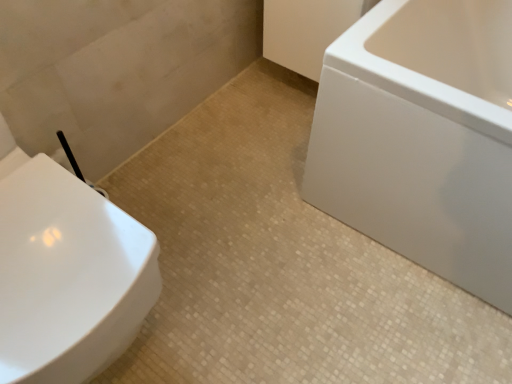
Describe the element at coordinates (422, 137) in the screenshot. I see `white glossy bathtub at right` at that location.

The image size is (512, 384). What do you see at coordinates (282, 263) in the screenshot? I see `beige mosaic tile at center` at bounding box center [282, 263].

Locate an element on the screen. Image resolution: width=512 pixels, height=384 pixels. white glossy toilet at left is located at coordinates (68, 276).

Is point (449, 227) closer to camera compared to point (99, 319)?

No, it is behind (99, 319).

Considering the relative positions of white glossy bathtub at right and white glossy toilet at left in the image provided, is white glossy bathtub at right to the left of white glossy toilet at left from the viewer's perspective?

Incorrect, white glossy bathtub at right is not on the left side of white glossy toilet at left.

From the image's perspective, which object appears higher, white glossy bathtub at right or white glossy toilet at left?

From the image's view, white glossy bathtub at right is above.

Is white glossy bathtub at right facing towards white glossy toilet at left?

Yes, white glossy bathtub at right is aimed at white glossy toilet at left.

Is beige mosaic tile at center not inside white glossy bathtub at right?

beige mosaic tile at center lies outside white glossy bathtub at right's area.

Between beige mosaic tile at center and white glossy bathtub at right, which one has more height?

With more height is white glossy bathtub at right.

From a real-world perspective, between beige mosaic tile at center and white glossy bathtub at right, who is vertically lower?

beige mosaic tile at center.

Can you confirm if beige mosaic tile at center is positioned to the right of white glossy bathtub at right?

No.

Considering the positions of objects white glossy toilet at left and beige mosaic tile at center in the image provided, who is more to the left, white glossy toilet at left or beige mosaic tile at center?

From the viewer's perspective, white glossy toilet at left appears more on the left side.

Which of these two, white glossy toilet at left or beige mosaic tile at center, is wider?

Wider between the two is beige mosaic tile at center.

From a real-world perspective, is white glossy toilet at left physically located above or below beige mosaic tile at center?

From a real-world perspective, white glossy toilet at left is physically above beige mosaic tile at center.

Are white glossy toilet at left and beige mosaic tile at center beside each other?

No, white glossy toilet at left is not with beige mosaic tile at center.

Do you think white glossy toilet at left is within white glossy bathtub at right, or outside of it?

white glossy toilet at left is spatially situated outside white glossy bathtub at right.

Considering the sizes of objects white glossy toilet at left and white glossy bathtub at right in the image provided, who is wider, white glossy toilet at left or white glossy bathtub at right?

With larger width is white glossy bathtub at right.

Is white glossy toilet at left oriented towards white glossy bathtub at right?

No, white glossy toilet at left is not aimed at white glossy bathtub at right.

Who is shorter, white glossy toilet at left or white glossy bathtub at right?

Standing shorter between the two is white glossy bathtub at right.

What's the angular difference between beige mosaic tile at center and white glossy toilet at left's facing directions?

1.42 degrees.

From the image's perspective, is beige mosaic tile at center above or below white glossy toilet at left?

Clearly, from the image's perspective, beige mosaic tile at center is below white glossy toilet at left.

Consider the image. Is beige mosaic tile at center inside the boundaries of white glossy toilet at left, or outside?

beige mosaic tile at center is spatially situated outside white glossy toilet at left.

Considering the sizes of objects beige mosaic tile at center and white glossy toilet at left in the image provided, who is thinner, beige mosaic tile at center or white glossy toilet at left?

white glossy toilet at left is thinner.

Which of these two, white glossy bathtub at right or beige mosaic tile at center, is bigger?

white glossy bathtub at right.

Considering the positions of points (500, 177) and (296, 122), is point (500, 177) farther from camera compared to point (296, 122)?

No, (500, 177) is closer to viewer.

Is white glossy bathtub at right next to beige mosaic tile at center and touching it?

No, white glossy bathtub at right is not making contact with beige mosaic tile at center.

Is beige mosaic tile at center at the back of white glossy bathtub at right?

No, white glossy bathtub at right is not facing away from beige mosaic tile at center.

Find the location of a particular element. This screenshot has height=384, width=512. bathtub above the white glossy toilet at left (from the image's perspective) is located at coordinates (422, 137).

You are a GUI agent. You are given a task and a screenshot of the screen. Output one action in this format:
    pyautogui.click(x=<x>, y=<y>)
    Task: Click on the ceramic tile on the left of white glossy bathtub at right
    
    Given the screenshot: What is the action you would take?
    pyautogui.click(x=282, y=263)

Which object lies further to the anchor point beige mosaic tile at center, white glossy toilet at left or white glossy bathtub at right?

white glossy toilet at left is positioned further to the anchor beige mosaic tile at center.

Considering their positions, is white glossy toilet at left positioned further to white glossy bathtub at right than beige mosaic tile at center?

white glossy toilet at left is positioned further to the anchor white glossy bathtub at right.

Based on their spatial positions, is beige mosaic tile at center or white glossy toilet at left closer to white glossy bathtub at right?

beige mosaic tile at center is closer to white glossy bathtub at right.

Estimate the real-world distances between objects in this image. Which object is further from white glossy toilet at left, beige mosaic tile at center or white glossy bathtub at right?

The object further to white glossy toilet at left is white glossy bathtub at right.

Which object lies further to the anchor point beige mosaic tile at center, white glossy bathtub at right or white glossy toilet at left?

white glossy toilet at left lies further to beige mosaic tile at center than the other object.

Which object lies further to the anchor point white glossy toilet at left, white glossy bathtub at right or beige mosaic tile at center?

white glossy bathtub at right.

Locate an element on the screen. This screenshot has height=384, width=512. ceramic tile between white glossy toilet at left and white glossy bathtub at right in the horizontal direction is located at coordinates (282, 263).